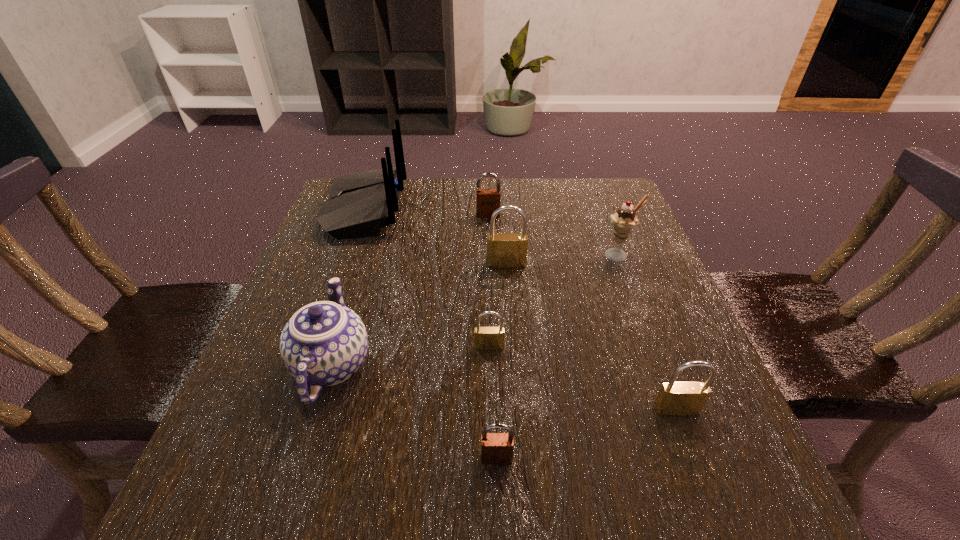
Find the location of a particular element. This screenshot has height=540, width=960. vacant space situated 0.070m on the front-facing side of the farther brown padlock is located at coordinates pos(489,234).

You are a GUI agent. You are given a task and a screenshot of the screen. Output one action in this format:
    pyautogui.click(x=<x>, y=<y>)
    Task: Click on the free space located 0.160m on the front-facing side of the nearest brass padlock
    The height and width of the screenshot is (540, 960).
    Given the screenshot: What is the action you would take?
    pyautogui.click(x=720, y=525)

Find the location of a particular element. blank space located 0.050m on the front-facing side of the smallest brass padlock is located at coordinates (490, 373).

Identify the location of router positioned at the far edge. pyautogui.click(x=360, y=203).

Locate an element on the screen. padlock that is positioned at the far edge is located at coordinates (487, 200).

You are a GUI agent. You are given a task and a screenshot of the screen. Output one action in this format:
    pyautogui.click(x=<x>, y=<y>)
    Task: Click on the object at the near edge
    This screenshot has width=960, height=540.
    Given the screenshot: What is the action you would take?
    pyautogui.click(x=496, y=448)

Locate an element on the screen. router at the left edge is located at coordinates (360, 203).

At what (x,y) coordinates should I click in order to perform the action: click on chinaware present at the left edge. Please return your answer as a coordinate pair (x, y). This screenshot has width=960, height=540. Looking at the image, I should click on (324, 343).

Where is `icecream that is at the right edge`? The image size is (960, 540). icecream that is at the right edge is located at coordinates (624, 220).

What are the coordinates of `padlock located at the right edge` in the screenshot? It's located at (675, 398).